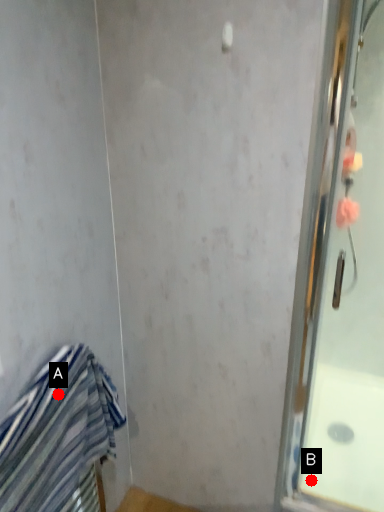
Question: Two points are circled on the image, labeled by A and B beside each circle. Which point is farther from the camera taking this photo?

Choices:
 (A) A is further
 (B) B is further

Answer: (B)